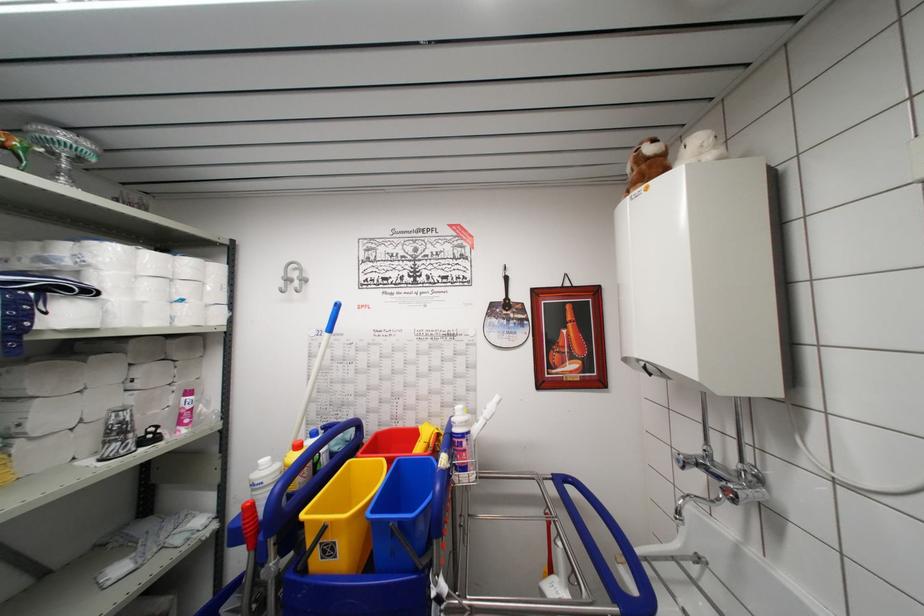
Identify the location of white spray bottle. (462, 447).